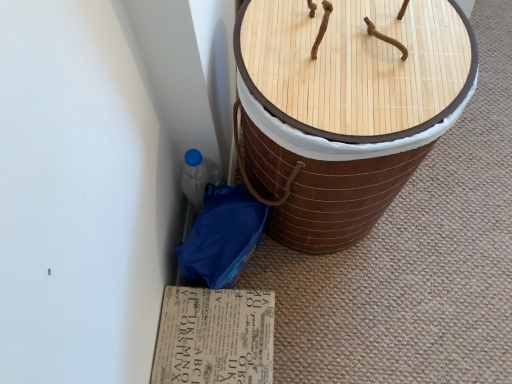
Question: Is printed cardboard at lower center at the left side of bamboo basket at center?

Choices:
 (A) yes
 (B) no

Answer: (A)

Question: Does printed cardboard at lower center touch bamboo basket at center?

Choices:
 (A) yes
 (B) no

Answer: (B)

Question: From a real-world perspective, is printed cardboard at lower center physically above bamboo basket at center?

Choices:
 (A) no
 (B) yes

Answer: (A)

Question: Is printed cardboard at lower center in front of bamboo basket at center?

Choices:
 (A) yes
 (B) no

Answer: (B)

Question: Is printed cardboard at lower center far away from bamboo basket at center?

Choices:
 (A) no
 (B) yes

Answer: (A)

Question: Does printed cardboard at lower center have a greater width compared to bamboo basket at center?

Choices:
 (A) no
 (B) yes

Answer: (A)

Question: Is the position of bamboo basket at center more distant than that of printed cardboard at lower center?

Choices:
 (A) no
 (B) yes

Answer: (A)

Question: Would you say printed cardboard at lower center is part of bamboo basket at center's contents?

Choices:
 (A) no
 (B) yes

Answer: (A)

Question: Is bamboo basket at center wider than printed cardboard at lower center?

Choices:
 (A) yes
 (B) no

Answer: (A)

Question: From the image's perspective, would you say bamboo basket at center is shown under printed cardboard at lower center?

Choices:
 (A) yes
 (B) no

Answer: (B)

Question: Would you consider bamboo basket at center to be distant from printed cardboard at lower center?

Choices:
 (A) no
 (B) yes

Answer: (A)

Question: Can you confirm if bamboo basket at center is thinner than printed cardboard at lower center?

Choices:
 (A) yes
 (B) no

Answer: (B)

Question: From a real-world perspective, is printed cardboard at lower center physically located above or below bamboo basket at center?

Choices:
 (A) below
 (B) above

Answer: (A)